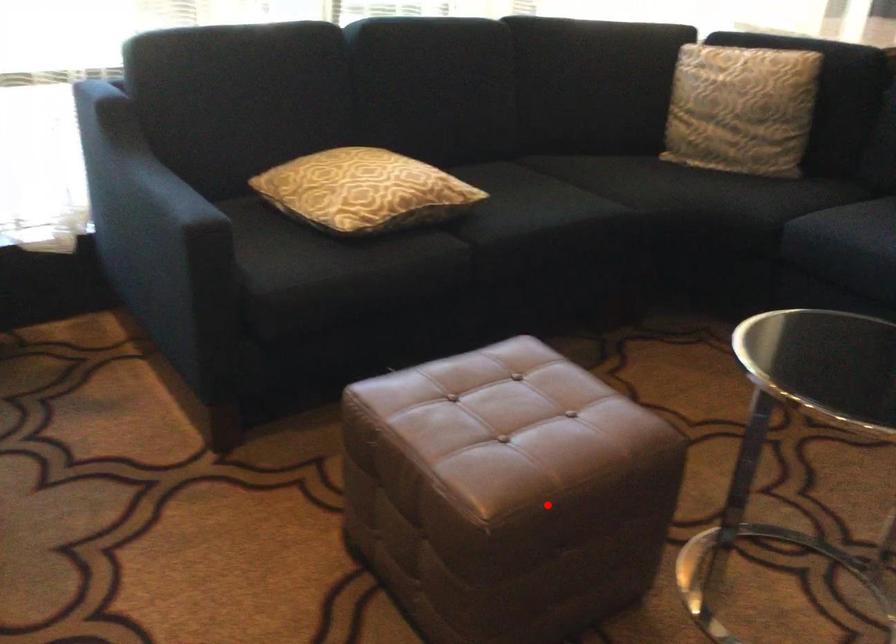
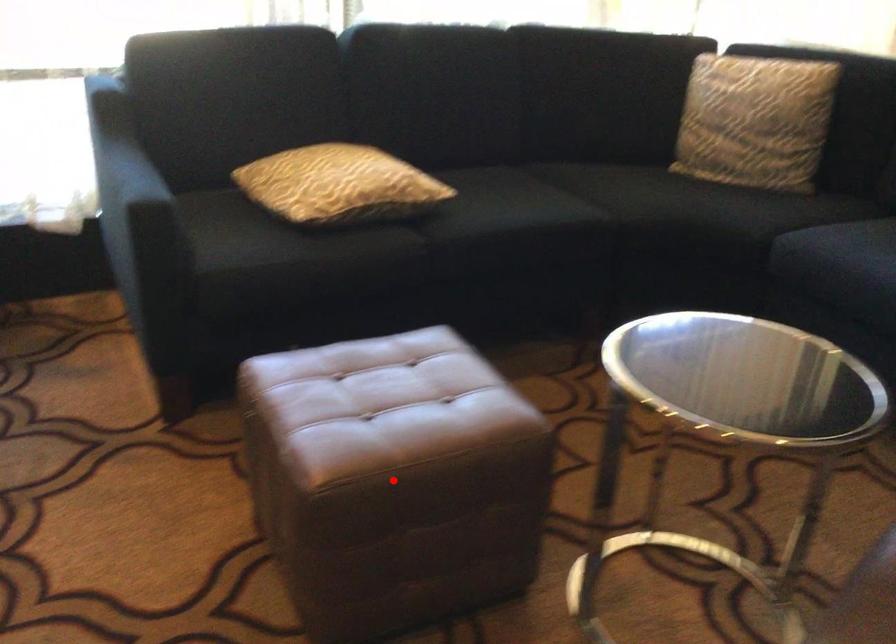
I am providing you with two images of the same scene from different viewpoints. A red point is marked on the first image and another point is marked on the second image. Are the points marked in image1 and image2 representing the same 3D position?

Yes